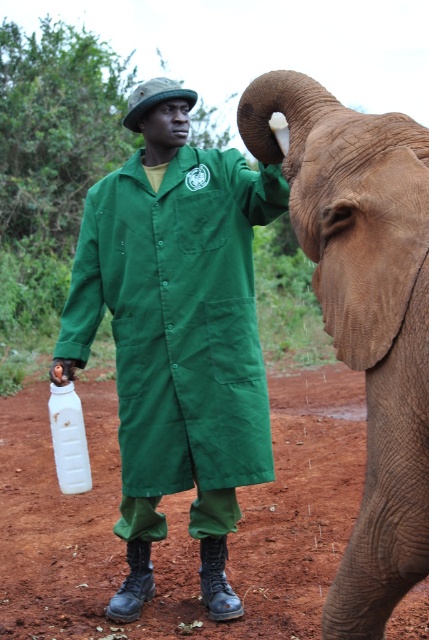
Question: Is green fabric uniform at center positioned at the back of brown textured skin at right?

Choices:
 (A) yes
 (B) no

Answer: (A)

Question: Is green fabric uniform at center thinner than brown textured skin at right?

Choices:
 (A) yes
 (B) no

Answer: (B)

Question: Which point is farther to the camera?

Choices:
 (A) (163, 88)
 (B) (428, 333)

Answer: (A)

Question: Which of the following is the closest to the observer?

Choices:
 (A) green fabric uniform at center
 (B) brown textured skin at right

Answer: (B)

Question: Does green fabric uniform at center have a greater width compared to brown textured skin at right?

Choices:
 (A) no
 (B) yes

Answer: (B)

Question: Which point is farther to the camera?

Choices:
 (A) green fabric uniform at center
 (B) brown textured skin at right

Answer: (A)